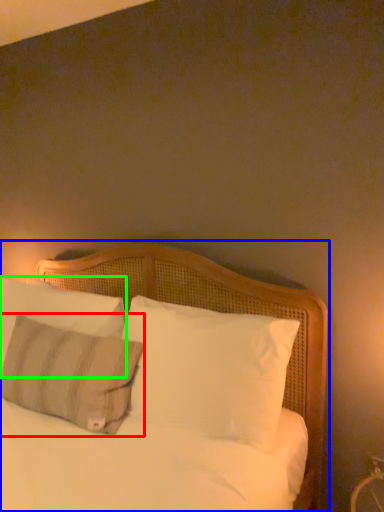
Question: Based on their relative distances, which object is nearer to pillow (highlighted by a red box)? Choose from bed (highlighted by a blue box) and pillow (highlighted by a green box).

Choices:
 (A) bed
 (B) pillow

Answer: (B)